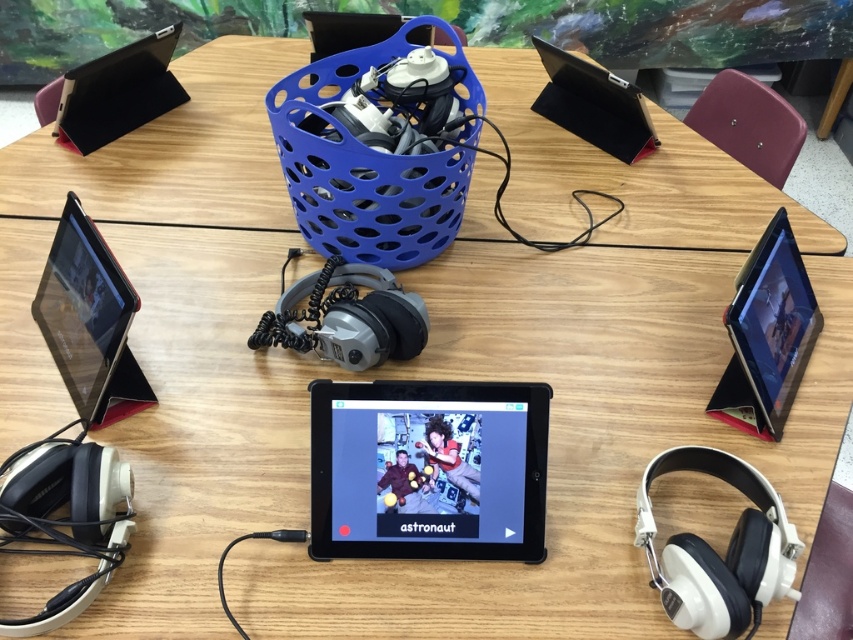
Does blue plastic basket at center have a lesser height compared to matte black tablet at left?

Incorrect, blue plastic basket at center's height does not fall short of matte black tablet at left's.

Does blue plastic basket at center come in front of matte black tablet at left?

That is False.

Between point (386, 140) and point (41, 321), which one is positioned in front?

Point (41, 321) is more forward.

This screenshot has width=853, height=640. I want to click on blue plastic basket at center, so click(379, 147).

Does blue plastic basket at center come behind white matte headphones at lower right?

Yes, it is.

Which is in front, point (305, 120) or point (769, 552)?

Positioned in front is point (769, 552).

Who is more distant from viewer, (361, 83) or (646, 550)?

The point (361, 83) is behind.

The image size is (853, 640). I want to click on blue plastic basket at center, so click(379, 147).

Who is taller, matte black tablet at center or matte black tablet at left?

Standing taller between the two is matte black tablet at left.

Does matte black tablet at center have a greater width compared to matte black tablet at left?

Indeed, matte black tablet at center has a greater width compared to matte black tablet at left.

The width and height of the screenshot is (853, 640). I want to click on matte black tablet at center, so pyautogui.click(x=430, y=467).